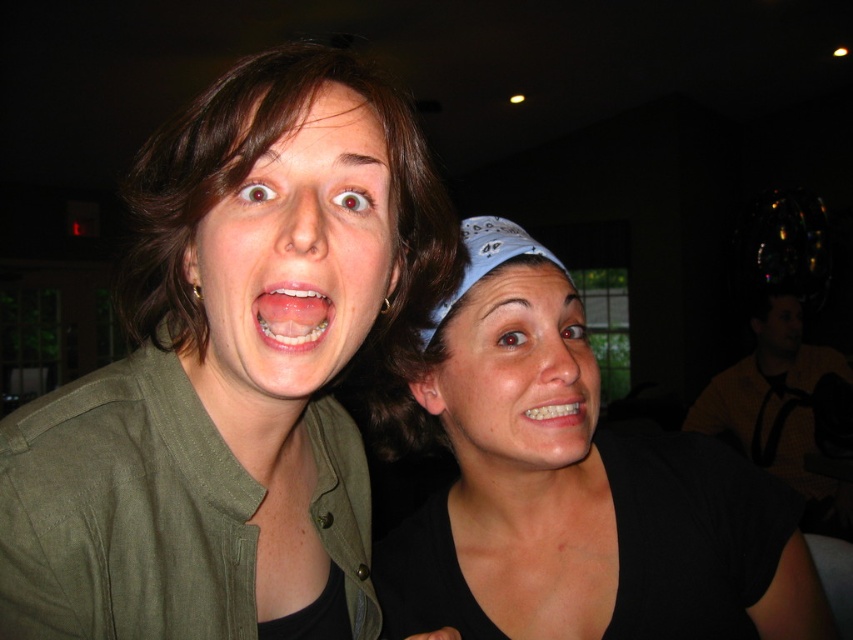
Is the position of matte green shirt at center more distant than that of matte white teeth at center?

No, it is not.

Does matte green shirt at center appear under matte white teeth at center?

Incorrect, matte green shirt at center is not positioned below matte white teeth at center.

Is point (219, 241) behind point (287, 349)?

Yes, it is.

At what (x,y) coordinates should I click in order to perform the action: click on matte green shirt at center. Please return your answer as a coordinate pair (x, y). This screenshot has height=640, width=853. Looking at the image, I should click on (294, 260).

Can you confirm if black matte bandana at center is wider than matte white teeth at center?

Correct, the width of black matte bandana at center exceeds that of matte white teeth at center.

Describe the element at coordinates (577, 492) in the screenshot. I see `black matte bandana at center` at that location.

Does point (492, 531) come farther from viewer compared to point (297, 332)?

That is True.

Find the location of `black matte bandana at center`. black matte bandana at center is located at coordinates (577, 492).

Does green matte jacket at upper left appear over matte white face at center?

Correct, green matte jacket at upper left is located above matte white face at center.

Can you confirm if green matte jacket at upper left is positioned to the left of matte white face at center?

Correct, you'll find green matte jacket at upper left to the left of matte white face at center.

Who is more distant from viewer, (329, 433) or (480, 307)?

The point (329, 433) is more distant.

Identify the location of green matte jacket at upper left. (228, 376).